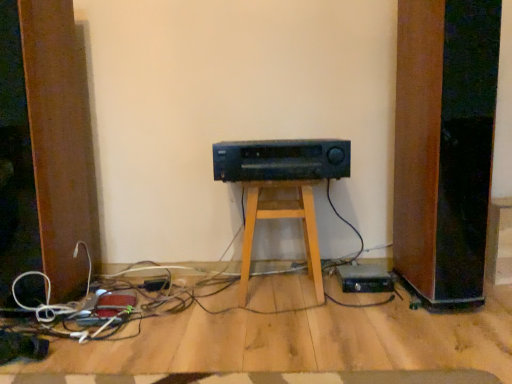
Question: Is black plastic amplifier at center spatially inside wooden stool at center, or outside of it?

Choices:
 (A) outside
 (B) inside

Answer: (A)

Question: Is black plastic amplifier at center in front of or behind wooden stool at center in the image?

Choices:
 (A) behind
 (B) front

Answer: (B)

Question: From the image's perspective, is black plastic amplifier at center positioned above or below wooden stool at center?

Choices:
 (A) below
 (B) above

Answer: (B)

Question: Does point (x=269, y=196) appear closer or farther from the camera than point (x=287, y=177)?

Choices:
 (A) closer
 (B) farther

Answer: (B)

Question: Looking at their shapes, would you say wooden stool at center is wider or thinner than black plastic amplifier at center?

Choices:
 (A) thin
 (B) wide

Answer: (A)

Question: From a real-world perspective, is wooden stool at center positioned above or below black plastic amplifier at center?

Choices:
 (A) above
 (B) below

Answer: (B)

Question: In the image, is wooden stool at center positioned in front of or behind black plastic amplifier at center?

Choices:
 (A) behind
 (B) front

Answer: (A)